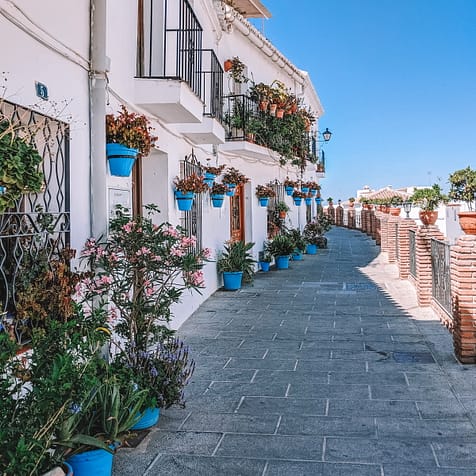
Image resolution: width=476 pixels, height=476 pixels. I want to click on lamp, so click(327, 135).